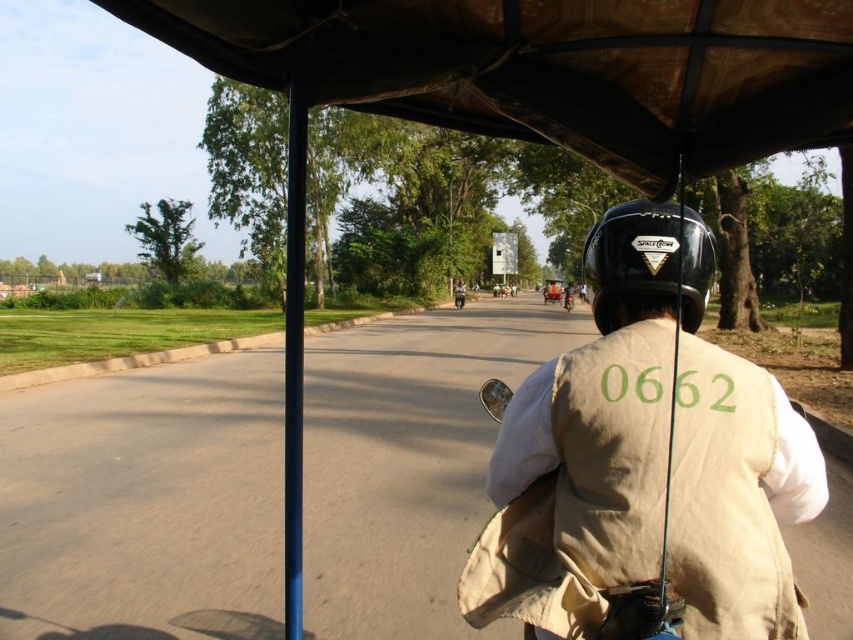
Is point (753, 586) behind point (630, 252)?

No.

Who is shorter, beige fabric vest at center or black matte helmet at center?

black matte helmet at center is shorter.

Locate an element on the screen. beige fabric vest at center is located at coordinates (666, 438).

At what (x,y) coordinates should I click in order to perform the action: click on beige fabric vest at center. Please return your answer as a coordinate pair (x, y). The height and width of the screenshot is (640, 853). Looking at the image, I should click on (666, 438).